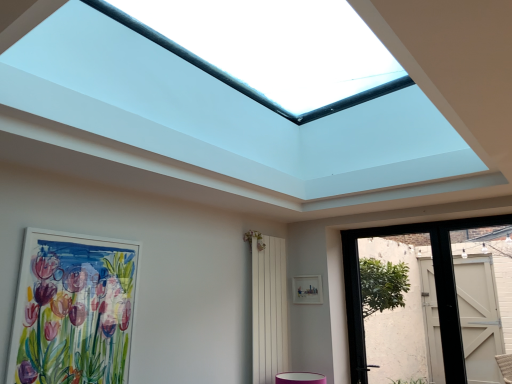
Question: From a real-world perspective, is white painted wood door at right, the first door positioned from the right, beneath matte white picture frame at left, marked as the second picture frame in a right-to-left arrangement?

Choices:
 (A) no
 (B) yes

Answer: (A)

Question: Is white painted wood door at right, the first door positioned from the right, wider than matte white picture frame at left, acting as the 2th picture frame starting from the back?

Choices:
 (A) no
 (B) yes

Answer: (B)

Question: From a real-world perspective, is white painted wood door at right, which is counted as the second door, starting from the left, physically above matte white picture frame at left, acting as the 2th picture frame starting from the back?

Choices:
 (A) yes
 (B) no

Answer: (A)

Question: Is white painted wood door at right, the first door positioned from the right, further to the viewer compared to matte white picture frame at left, marked as the second picture frame in a right-to-left arrangement?

Choices:
 (A) yes
 (B) no

Answer: (A)

Question: Is white painted wood door at right, which is counted as the second door, starting from the left, positioned in front of matte white picture frame at left, placed as the 1th picture frame when sorted from front to back?

Choices:
 (A) yes
 (B) no

Answer: (B)

Question: Is white painted wood door at right, which is counted as the second door, starting from the left, bigger than matte white picture frame at left, placed as the 1th picture frame when sorted from front to back?

Choices:
 (A) no
 (B) yes

Answer: (B)

Question: Considering the relative positions of white wooden screen door at center and matte white picture frame at left, placed as the 1th picture frame when sorted from front to back, in the image provided, is white wooden screen door at center in front of matte white picture frame at left, placed as the 1th picture frame when sorted from front to back,?

Choices:
 (A) no
 (B) yes

Answer: (A)

Question: From a real-world perspective, is white wooden screen door at center physically below matte white picture frame at left, the 1th picture frame from the left?

Choices:
 (A) yes
 (B) no

Answer: (A)

Question: Considering the relative sizes of white wooden screen door at center and matte white picture frame at left, the 1th picture frame from the left, in the image provided, is white wooden screen door at center taller than matte white picture frame at left, the 1th picture frame from the left,?

Choices:
 (A) yes
 (B) no

Answer: (A)

Question: From the image's perspective, is white wooden screen door at center over matte white picture frame at left, acting as the 2th picture frame starting from the back?

Choices:
 (A) no
 (B) yes

Answer: (A)

Question: Is white wooden screen door at center touching matte white picture frame at left, marked as the second picture frame in a right-to-left arrangement?

Choices:
 (A) yes
 (B) no

Answer: (B)

Question: Can you confirm if white wooden screen door at center is smaller than matte white picture frame at left, marked as the second picture frame in a right-to-left arrangement?

Choices:
 (A) yes
 (B) no

Answer: (B)

Question: From the image's perspective, is white matte picture frame at center, the second picture frame positioned from the front, below white painted wood door at right, the first door positioned from the right?

Choices:
 (A) yes
 (B) no

Answer: (A)